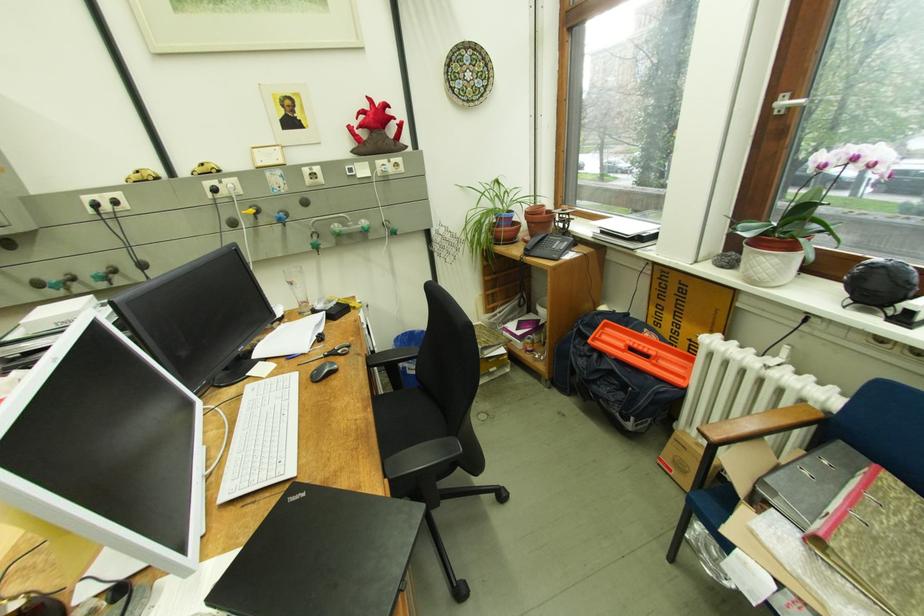
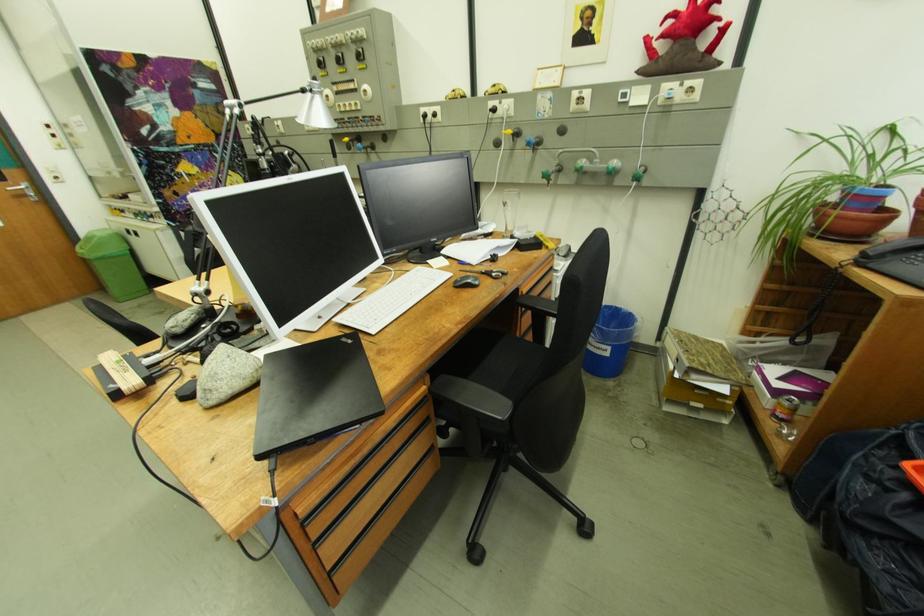
Question: The camera is either moving clockwise (left) or counter-clockwise (right) around the object. The first image is from the beginning of the video and the second image is from the end. Is the camera moving left or right when shooting the video?

Choices:
 (A) Left
 (B) Right

Answer: (B)